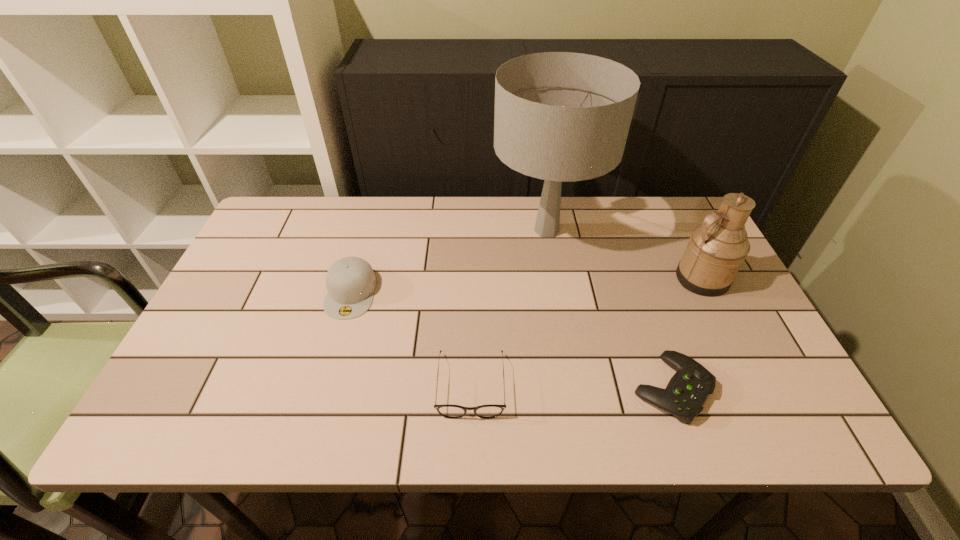
Find the location of a particular element. vacant space located 0.270m on the left of the rightmost object is located at coordinates pos(574,278).

Locate an element on the screen. free space located on the front-facing side of the third tallest object is located at coordinates (327, 376).

I want to click on free space located 0.280m on the back of the shortest object, so click(631, 270).

Find the location of a particular element. This screenshot has height=540, width=960. object at the far edge is located at coordinates (561, 117).

The width and height of the screenshot is (960, 540). What are the coordinates of `spectacles that is at the near edge` in the screenshot? It's located at (449, 411).

Locate an element on the screen. The width and height of the screenshot is (960, 540). control situated at the near edge is located at coordinates (687, 391).

Locate an element on the screen. The image size is (960, 540). object that is positioned at the right edge is located at coordinates (717, 248).

Where is `vacant area at the far edge of the desktop`? This screenshot has width=960, height=540. vacant area at the far edge of the desktop is located at coordinates 356,208.

Locate an element on the screen. This screenshot has height=540, width=960. vacant space at the near edge is located at coordinates (303, 429).

Identify the location of vacant space at the left edge of the desktop. (195, 382).